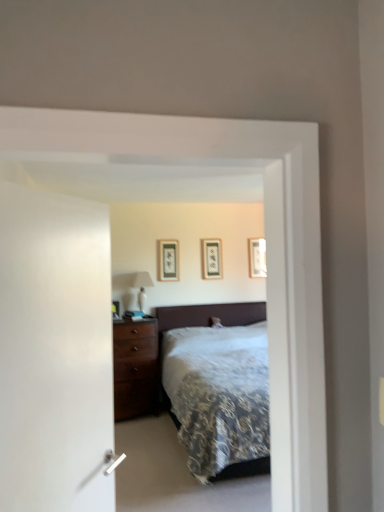
Question: Is matte black picture frame at center, placed as the second picture frame when sorted from front to back, at the right side of matte black picture frame at center, the first picture frame positioned from the front?

Choices:
 (A) yes
 (B) no

Answer: (A)

Question: Is matte black picture frame at center, placed as the second picture frame when sorted from front to back, thinner than matte black picture frame at center, acting as the 3th picture frame starting from the right?

Choices:
 (A) no
 (B) yes

Answer: (B)

Question: From a real-world perspective, is matte black picture frame at center, the second picture frame positioned from the left, under matte black picture frame at center, which is the third picture frame in back-to-front order?

Choices:
 (A) yes
 (B) no

Answer: (A)

Question: Is matte black picture frame at center, the 2th picture frame from the back, aimed at matte black picture frame at center, acting as the 3th picture frame starting from the right?

Choices:
 (A) no
 (B) yes

Answer: (A)

Question: Does matte black picture frame at center, the second picture frame positioned from the left, have a larger size compared to matte black picture frame at center, the first picture frame positioned from the front?

Choices:
 (A) no
 (B) yes

Answer: (A)

Question: Are matte black picture frame at center, the 2th picture frame when ordered from right to left, and matte black picture frame at center, the first picture frame positioned from the front, beside each other?

Choices:
 (A) no
 (B) yes

Answer: (A)

Question: Is matte black picture frame at center, acting as the 3th picture frame starting from the right, at the left side of matte black picture frame at center, the second picture frame positioned from the left?

Choices:
 (A) no
 (B) yes

Answer: (B)

Question: Does matte black picture frame at center, which is the third picture frame in back-to-front order, appear on the right side of matte black picture frame at center, the 2th picture frame when ordered from right to left?

Choices:
 (A) yes
 (B) no

Answer: (B)

Question: Is matte black picture frame at center, which is counted as the 1th picture frame, starting from the left, taller than matte black picture frame at center, the 2th picture frame when ordered from right to left?

Choices:
 (A) yes
 (B) no

Answer: (A)

Question: Can you confirm if matte black picture frame at center, the first picture frame positioned from the front, is smaller than matte black picture frame at center, the 2th picture frame from the back?

Choices:
 (A) no
 (B) yes

Answer: (A)

Question: Is matte black picture frame at center, which is the third picture frame in back-to-front order, facing towards matte black picture frame at center, the 2th picture frame from the back?

Choices:
 (A) no
 (B) yes

Answer: (A)

Question: Is the depth of matte black picture frame at center, which is the third picture frame in back-to-front order, greater than that of matte black picture frame at center, placed as the second picture frame when sorted from front to back?

Choices:
 (A) yes
 (B) no

Answer: (B)

Question: Are wooden picture frame at upper right, marked as the first picture frame in a right-to-left arrangement, and white glossy table lamp at left located far from each other?

Choices:
 (A) yes
 (B) no

Answer: (A)